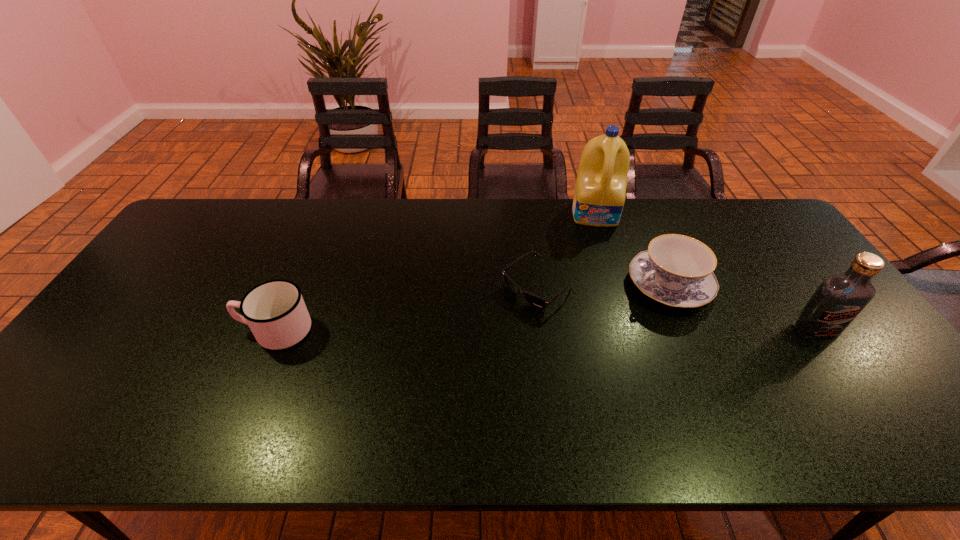
Identify the location of vacant space on the desktop that is between the mug and the vodka and is positioned with the handle on the side of the chinaware. (588, 330).

I want to click on vacant spot on the desktop that is between the leftmost object and the vodka and is positioned on the label of the farthest object, so click(609, 330).

Find the location of a particular element. The height and width of the screenshot is (540, 960). free space on the desktop that is between the leftmost object and the vodka and is positioned on the front-facing side of the shortest object is located at coordinates (485, 330).